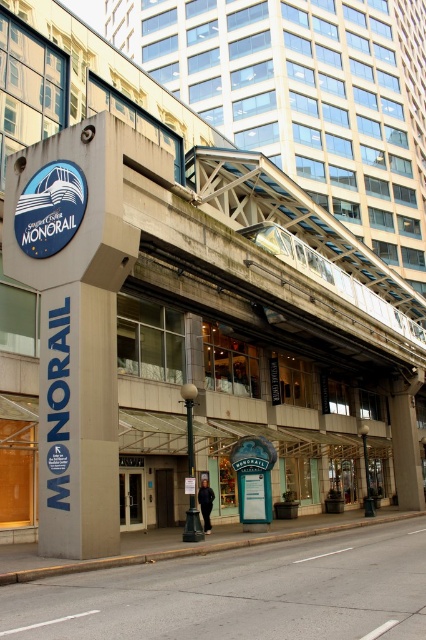
Who is lower down, gray concrete sign at left or blue glossy monorail sign at upper left?

gray concrete sign at left is lower down.

Where is `gray concrete sign at left`? This screenshot has width=426, height=640. gray concrete sign at left is located at coordinates (74, 320).

Is point (114, 150) positioned after point (31, 200)?

No, (114, 150) is in front of (31, 200).

Locate an element on the screen. This screenshot has height=640, width=426. gray concrete sign at left is located at coordinates (74, 320).